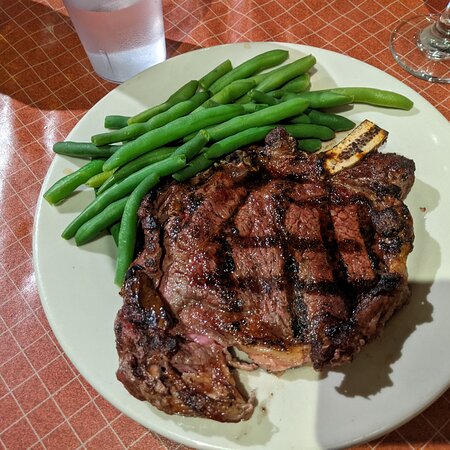
Where is `champagne glass`? champagne glass is located at coordinates (415, 42).